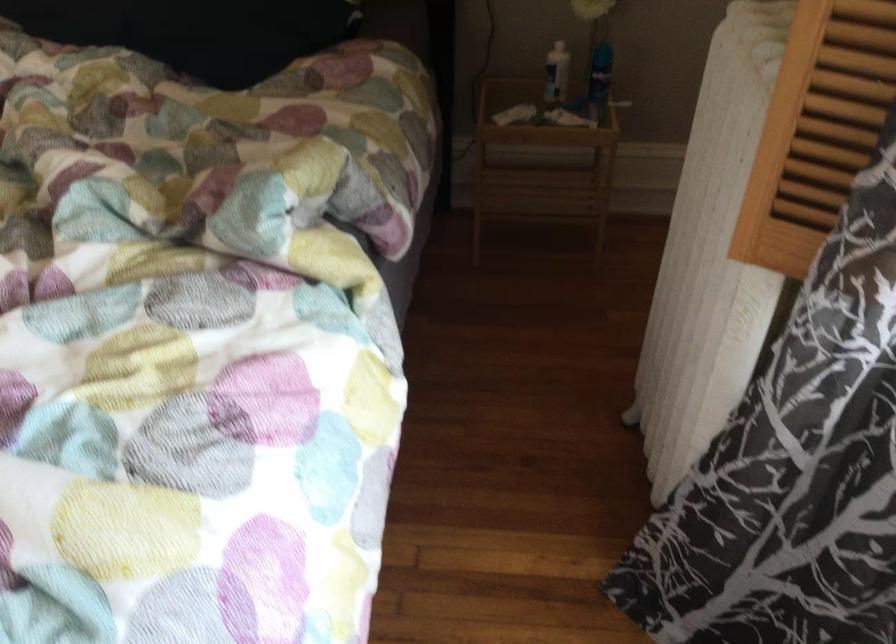
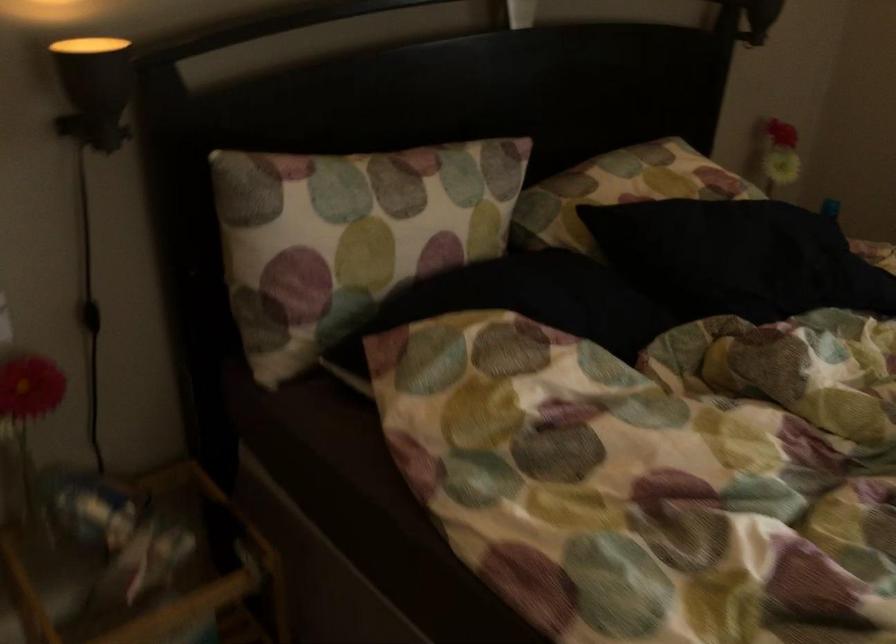
Question: I am providing you with two images of the same scene from different viewpoints. Which of the following objects are not visible in image2?

Choices:
 (A) patterned white pillow
 (B) black cord switch
 (C) urinal flush handle
 (D) white pump bottle

Answer: (D)